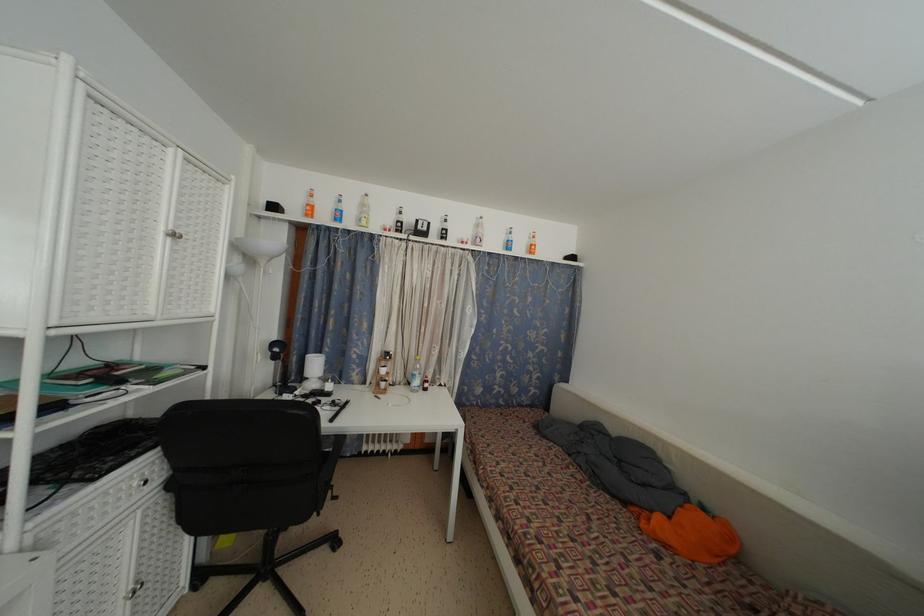
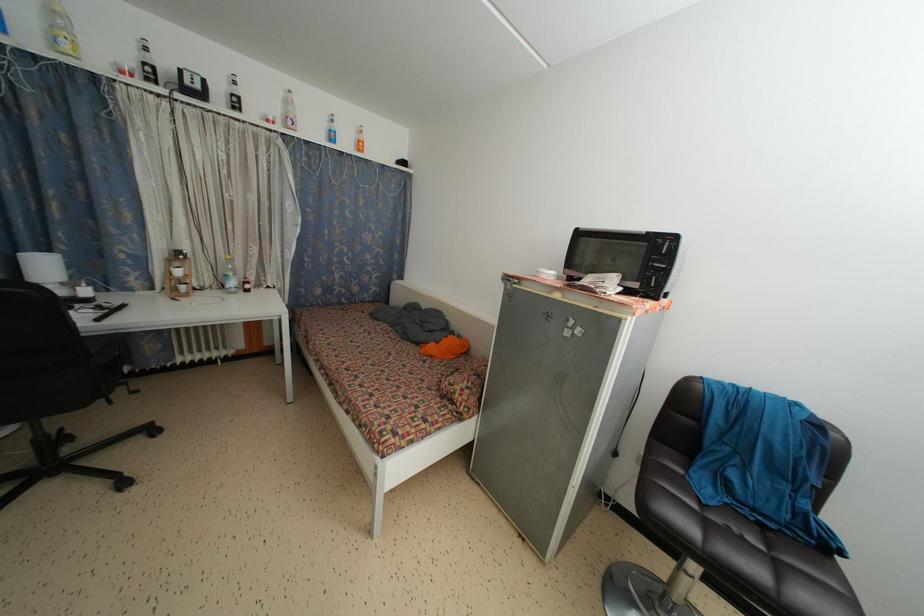
Locate, in the second image, the point that corresponds to (x=344, y=444) in the first image.

(127, 345)